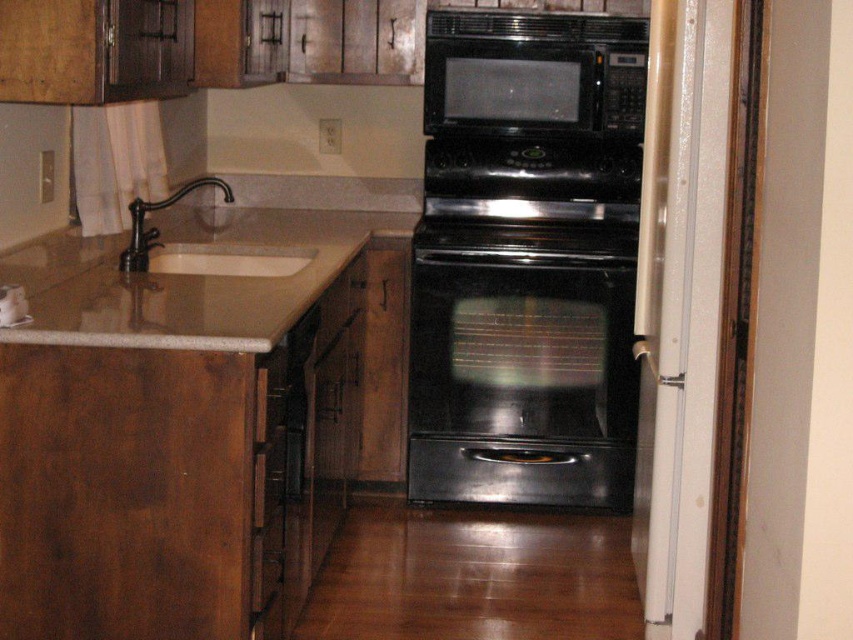
You are a kitchen designer and need to place a new spice rack between the black glossy oven at center and the black matte microwave at upper center. Which appliance should the spice rack be placed closer to, the oven or the microwave?

The spice rack should be placed closer to the black glossy oven at center because it is positioned on the left side of the black matte microwave at upper center, so the oven is to the left and the microwave is to the right. Placing the spice rack near the oven maintains symmetry and accessibility.

From the picture: You are a kitchen designer planning to install a new microwave above the black glossy oven at center and the brown granite sink at left. Based on their heights, which appliance should the microwave be placed above to ensure proper functionality and safety?

The microwave should be placed above the black glossy oven at center because it is much taller than the brown granite sink at left, providing sufficient vertical space for the microwave to be installed safely and function properly.